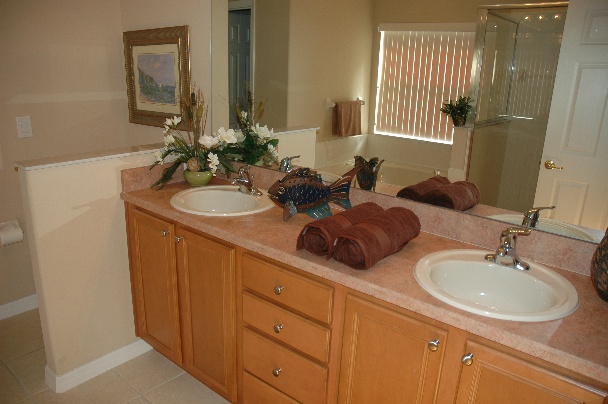
Identify the location of door handle. (554, 162).